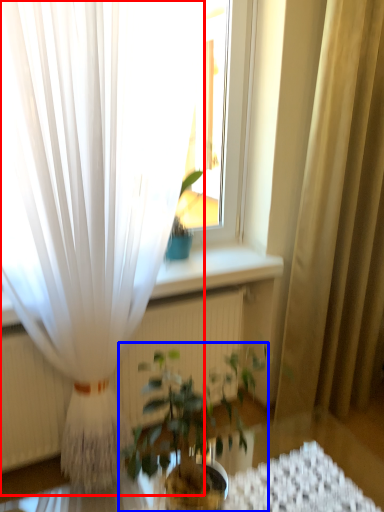
Question: Which object is closer to the camera taking this photo, curtain (highlighted by a red box) or houseplant (highlighted by a blue box)?

Choices:
 (A) curtain
 (B) houseplant

Answer: (B)